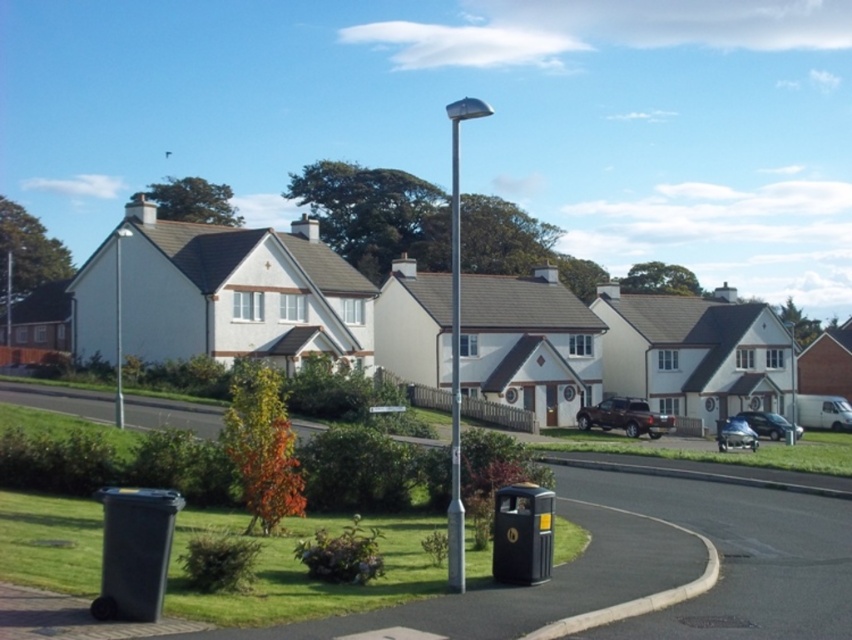
Is shiny blue sedan at right to the right of shiny silver car at center from the viewer's perspective?

In fact, shiny blue sedan at right is to the left of shiny silver car at center.

Who is shorter, shiny blue sedan at right or shiny silver car at center?

shiny silver car at center

Where is `shiny blue sedan at right`? The height and width of the screenshot is (640, 852). shiny blue sedan at right is located at coordinates (735, 435).

Can you confirm if silver metallic pole at center is positioned to the right of metallic silver pole at center?

Indeed, silver metallic pole at center is positioned on the right side of metallic silver pole at center.

Image resolution: width=852 pixels, height=640 pixels. What do you see at coordinates (456, 346) in the screenshot?
I see `silver metallic pole at center` at bounding box center [456, 346].

Which is in front, point (458, 509) or point (453, 193)?

Point (458, 509)

At what (x,y) coordinates should I click in order to perform the action: click on silver metallic pole at center. Please return your answer as a coordinate pair (x, y). The image size is (852, 640). Looking at the image, I should click on (456, 346).

Which is more to the right, silver metallic pole at center or shiny blue sedan at right?

Positioned to the right is shiny blue sedan at right.

Which is behind, point (452, 182) or point (737, 428)?

Point (452, 182)

This screenshot has height=640, width=852. Find the location of `silver metallic pole at center`. silver metallic pole at center is located at coordinates (456, 346).